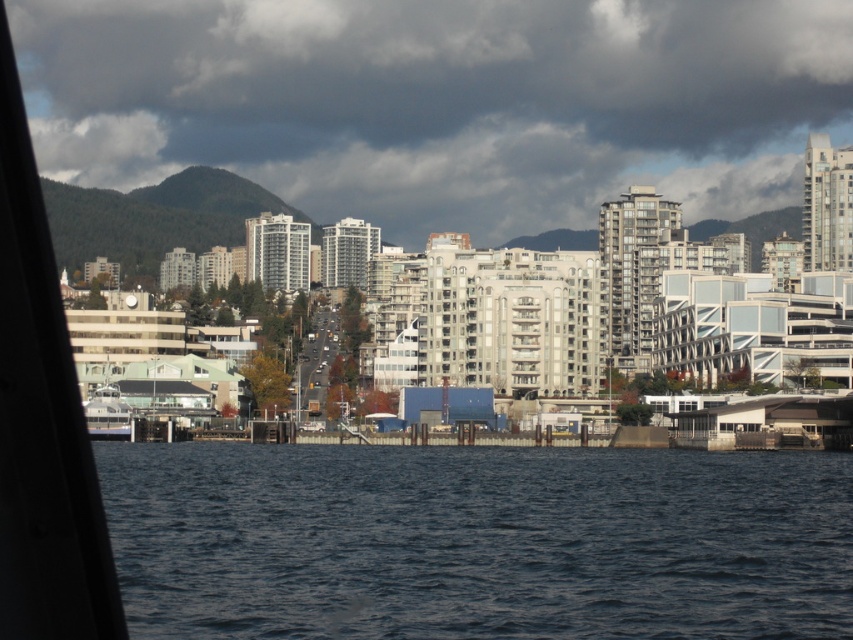
Does dark gray cloud at upper center appear on the left side of white glossy ferry at lower left?

No, dark gray cloud at upper center is not to the left of white glossy ferry at lower left.

Is the position of dark gray cloud at upper center less distant than that of white glossy ferry at lower left?

No, dark gray cloud at upper center is behind white glossy ferry at lower left.

Which is behind, point (403, 38) or point (126, 416)?

The point (403, 38) is behind.

Identify the location of dark gray cloud at upper center. [x=440, y=102].

Which is in front, point (425, 29) or point (402, 512)?

Point (402, 512) is in front.

Is point (392, 29) in front of point (428, 532)?

No, (392, 29) is behind (428, 532).

You are a GUI agent. You are given a task and a screenshot of the screen. Output one action in this format:
    pyautogui.click(x=<x>, y=<y>)
    Task: Click on the dark gray cloud at upper center
    The height and width of the screenshot is (640, 853).
    Given the screenshot: What is the action you would take?
    pyautogui.click(x=440, y=102)

Is dark blue water at center positioned before white glossy ferry at lower left?

Yes, dark blue water at center is closer to the viewer.

Is dark blue water at center bigger than white glossy ferry at lower left?

Indeed, dark blue water at center has a larger size compared to white glossy ferry at lower left.

This screenshot has width=853, height=640. Find the location of `dark blue water at center`. dark blue water at center is located at coordinates 477,541.